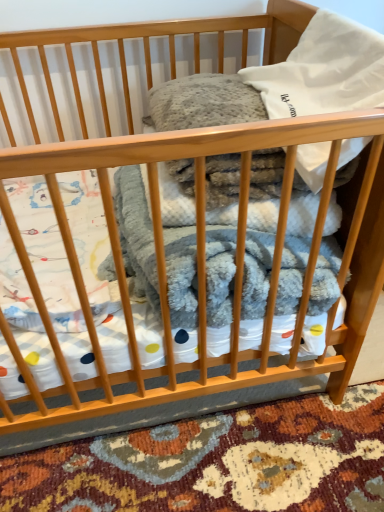
Identify the location of empty space that is ontop of fluffy carpet at lower center. (216, 443).